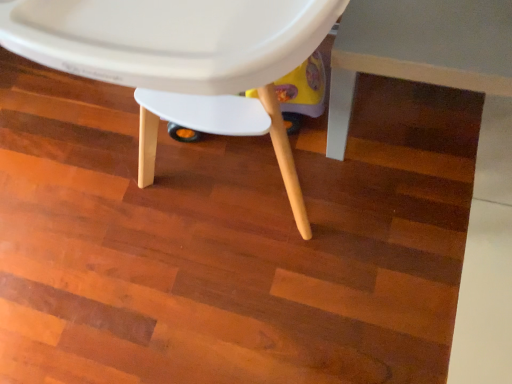
Question: Is white matte table at lower right inside white matte plastic chair at center?

Choices:
 (A) yes
 (B) no

Answer: (B)

Question: Is white matte plastic chair at center to the left of white matte table at lower right from the viewer's perspective?

Choices:
 (A) no
 (B) yes

Answer: (B)

Question: Is white matte plastic chair at center turned away from white matte table at lower right?

Choices:
 (A) no
 (B) yes

Answer: (A)

Question: Is white matte plastic chair at center not inside white matte table at lower right?

Choices:
 (A) no
 (B) yes

Answer: (B)

Question: Can you confirm if white matte plastic chair at center is wider than white matte table at lower right?

Choices:
 (A) no
 (B) yes

Answer: (B)

Question: Does white matte plastic chair at center appear on the right side of white matte table at lower right?

Choices:
 (A) yes
 (B) no

Answer: (B)

Question: Is the depth of white matte table at lower right less than that of white matte plastic chair at center?

Choices:
 (A) yes
 (B) no

Answer: (B)

Question: From a real-world perspective, is white matte table at lower right physically above white matte plastic chair at center?

Choices:
 (A) no
 (B) yes

Answer: (A)

Question: Is white matte table at lower right to the right of white matte plastic chair at center from the viewer's perspective?

Choices:
 (A) no
 (B) yes

Answer: (B)

Question: From the image's perspective, is white matte table at lower right on top of white matte plastic chair at center?

Choices:
 (A) yes
 (B) no

Answer: (B)

Question: Does white matte table at lower right have a smaller size compared to white matte plastic chair at center?

Choices:
 (A) yes
 (B) no

Answer: (A)

Question: Is white matte table at lower right outside of white matte plastic chair at center?

Choices:
 (A) no
 (B) yes

Answer: (B)

Question: From a real-world perspective, is white matte table at lower right above or below white matte plastic chair at center?

Choices:
 (A) below
 (B) above

Answer: (A)